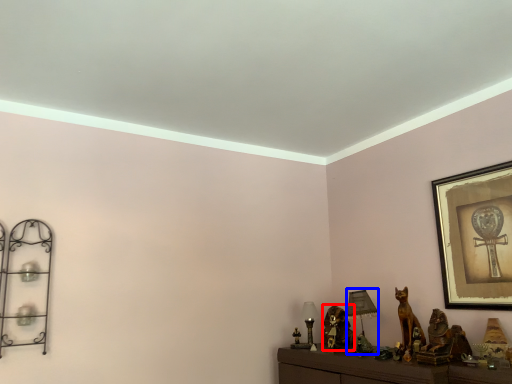
Question: Which of the following is the farthest to the observer, animal (highlighted by a red box) or table lamp (highlighted by a blue box)?

Choices:
 (A) animal
 (B) table lamp

Answer: (A)